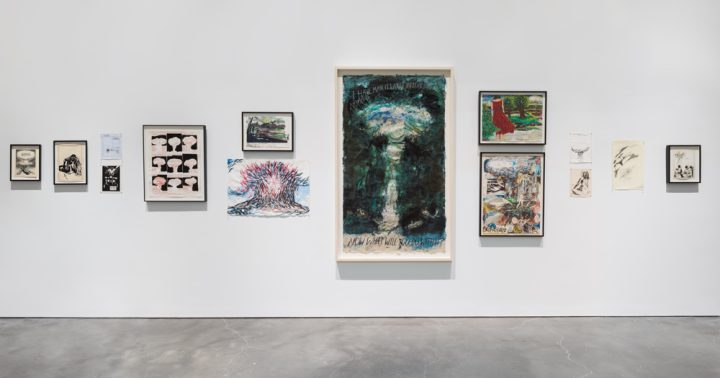
Where is `pictures`? The image size is (720, 378). pictures is located at coordinates tap(378, 180).